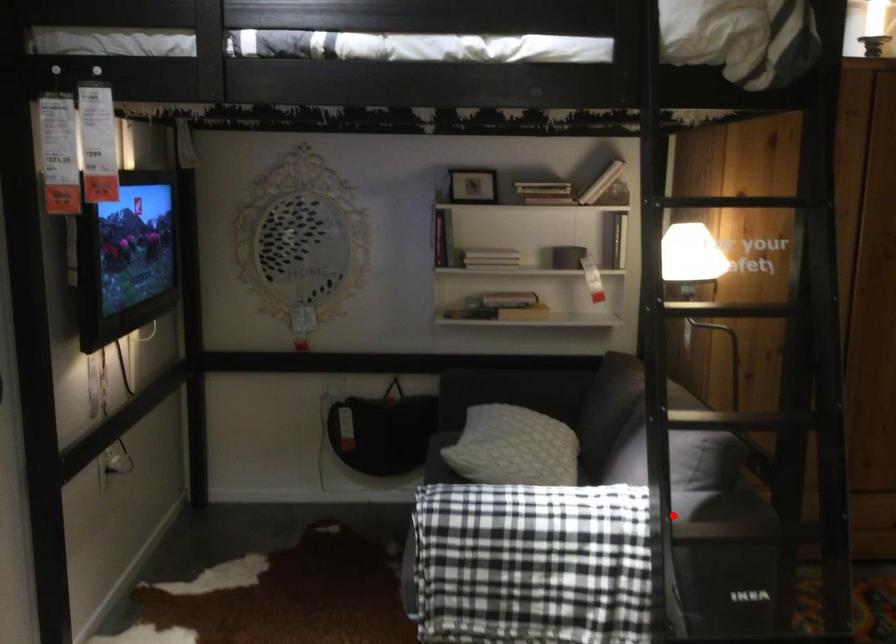
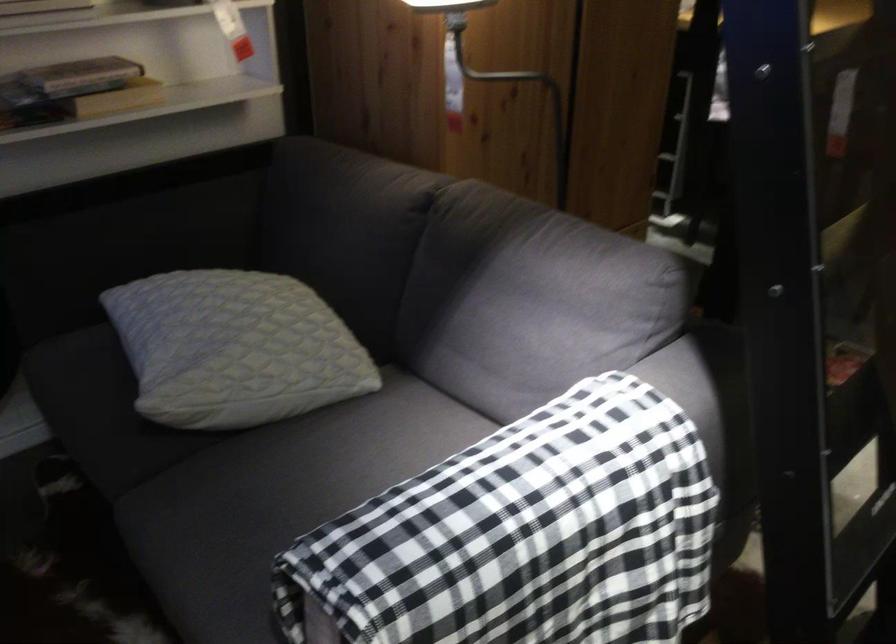
Where in the second image is the point corresponding to the highlighted location from the first image?

(690, 395)